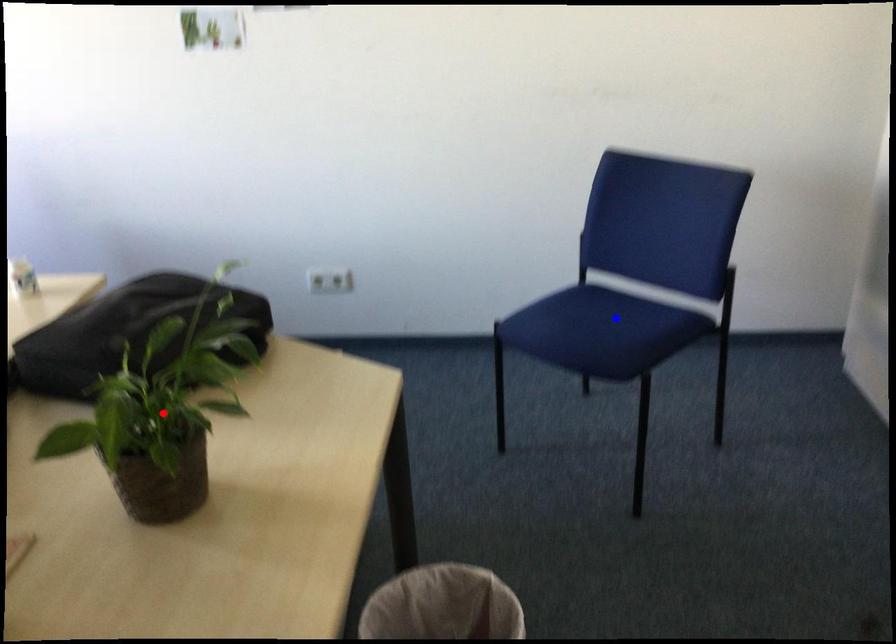
Question: Two points are marked on the image. Which point is closer to the camera?

Choices:
 (A) Blue point is closer.
 (B) Red point is closer.

Answer: (B)